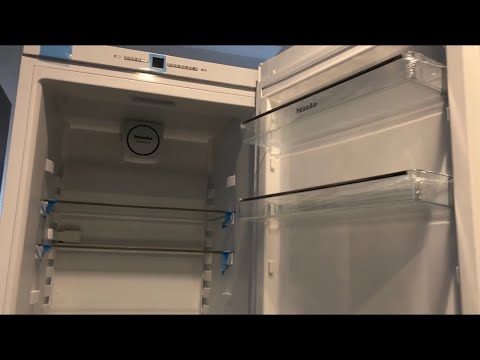
I want to click on refrigerator top, so click(89, 113).